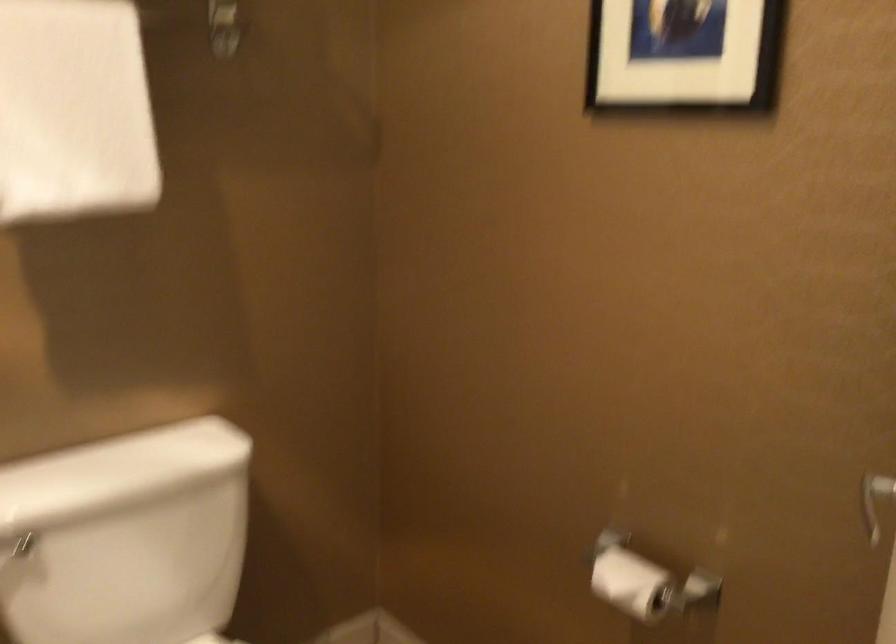
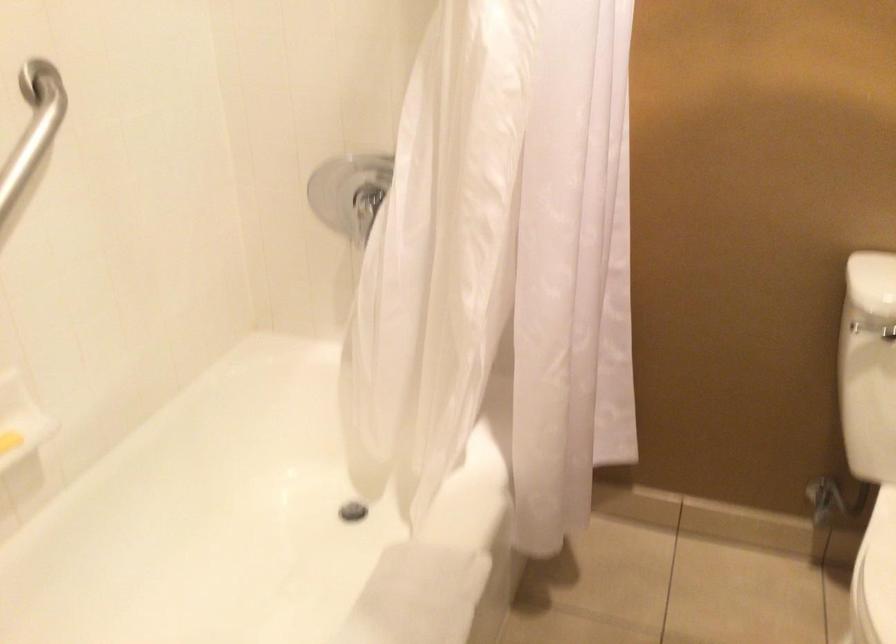
First-person continuous shooting, in which direction is the camera rotating?

The rotation direction of the camera is left-down.